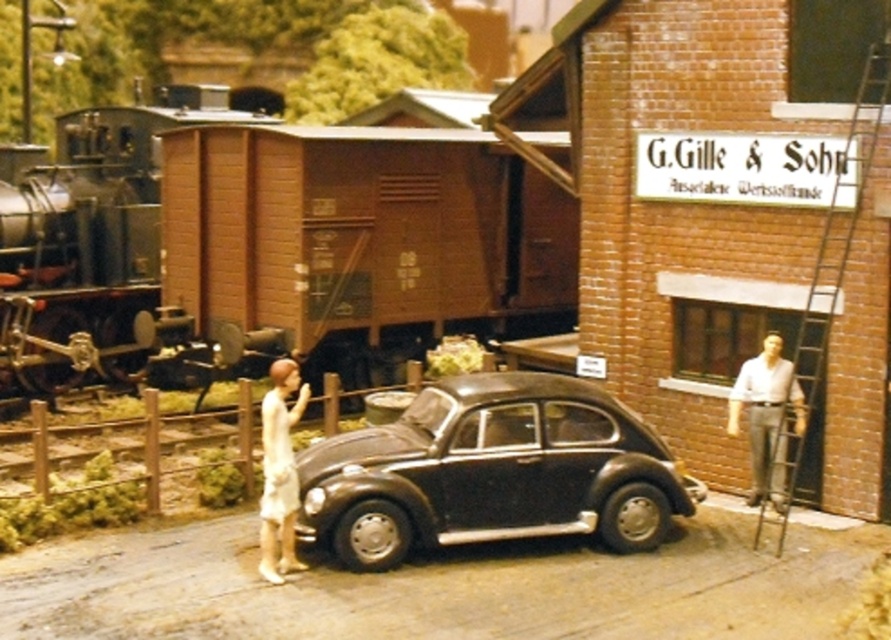
Is brown wooden train at center wider than light blue shirt at right?

Indeed, brown wooden train at center has a greater width compared to light blue shirt at right.

Does point (560, 218) lie in front of point (758, 486)?

No, it is behind (758, 486).

What do you see at coordinates (270, 248) in the screenshot? I see `brown wooden train at center` at bounding box center [270, 248].

Find the location of a particular element. brown wooden train at center is located at coordinates (270, 248).

Looking at this image, between brown wooden train at center and white cloth at center, which one has more height?

brown wooden train at center is taller.

How much distance is there between brown wooden train at center and white cloth at center?

The distance of brown wooden train at center from white cloth at center is 6.42 meters.

Find the location of `brown wooden train at center`. brown wooden train at center is located at coordinates (270, 248).

Where is `matte black car at center`? The image size is (891, 640). matte black car at center is located at coordinates (491, 472).

Can you confirm if matte black car at center is smaller than light blue shirt at right?

Incorrect, matte black car at center is not smaller in size than light blue shirt at right.

Does point (574, 499) come behind point (793, 406)?

No, it is in front of (793, 406).

At what (x,y) coordinates should I click in order to perform the action: click on matte black car at center. Please return your answer as a coordinate pair (x, y). Looking at the image, I should click on (491, 472).